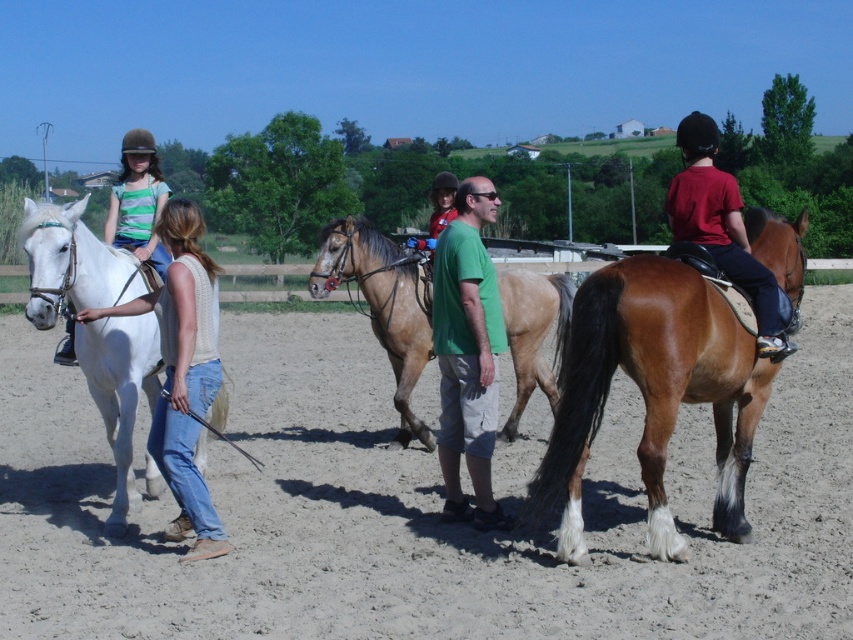
You are a photographer standing at the center of the scene. You want to take a picture of the brown glossy horse at right. Based on the coordinates provided, in which direction should you move to position yourself directly in front of the horse?

The brown glossy horse at right is located at coordinates point (653, 392). To position yourself directly in front of the horse, you should move to the right side of the scene since the horse is positioned at the right side of the image.

You are standing at the point marked as point (467,353) in the image. What color is the clothing item you are touching?

The point (467,353) is on the green cotton shirt at center, so the clothing item you are touching is green in color.